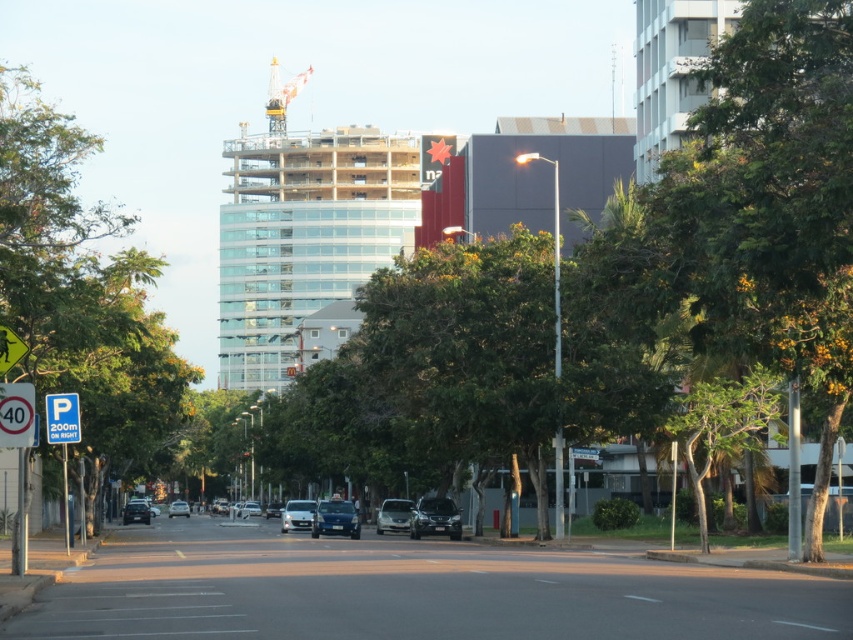
Based on the photo, you are a city planner analyzing this street scene. You need to determine if the yellow plastic speed limit sign at upper left can be placed on the same pole as the yellow metallic crane at upper center. The pole can only support items with a combined width of 1.2 meters. What should you consider based on their widths?

The yellow plastic speed limit sign at upper left has a smaller width than the yellow metallic crane at upper center. However, without knowing the exact widths of both objects, it is impossible to determine if their combined width exceeds the pole capacity of 1.2 meters. Additional measurements are needed.

You are a driver approaching the intersection and see the yellow plastic speed limit sign at upper left and the yellow metallic crane at upper center. Which object is closer to the horizon?

The yellow plastic speed limit sign at upper left is below the yellow metallic crane at upper center, so the crane is closer to the horizon.